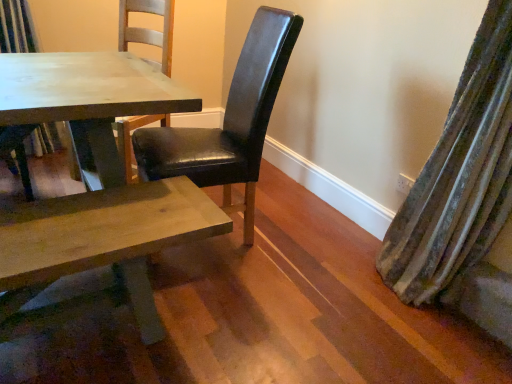
At what (x,y) coordinates should I click in order to perform the action: click on matte wooden table at center. Please return your answer as a coordinate pair (x, y). This screenshot has height=384, width=512. Looking at the image, I should click on (88, 100).

Describe the element at coordinates (88, 100) in the screenshot. I see `matte wooden table at center` at that location.

The image size is (512, 384). Find the location of `matte black chair at center, the second chair viewed from the front`. matte black chair at center, the second chair viewed from the front is located at coordinates 28,149.

The height and width of the screenshot is (384, 512). Find the location of `black leather chair at center, arranged as the second chair when viewed from the left`. black leather chair at center, arranged as the second chair when viewed from the left is located at coordinates (229, 121).

I want to click on matte wooden table at center, so click(x=88, y=100).

In the image, is matte black chair at center, positioned as the 1th chair in back-to-front order, on the left side or the right side of black leather chair at center, which is counted as the 2th chair, starting from the back?

From the image, it's evident that matte black chair at center, positioned as the 1th chair in back-to-front order, is to the left of black leather chair at center, which is counted as the 2th chair, starting from the back.

Can you confirm if matte black chair at center, the second chair viewed from the front, is shorter than black leather chair at center, the 1th chair viewed from the right?

Indeed, matte black chair at center, the second chair viewed from the front, has a lesser height compared to black leather chair at center, the 1th chair viewed from the right.

Considering the points (4, 10) and (237, 88), which point is behind, point (4, 10) or point (237, 88)?

The point (237, 88) is farther from the camera.

Can you tell me how much matte black chair at center, positioned as the 1th chair in back-to-front order, and black leather chair at center, arranged as the second chair when viewed from the left, differ in facing direction?

The angular difference between matte black chair at center, positioned as the 1th chair in back-to-front order, and black leather chair at center, arranged as the second chair when viewed from the left, is 99.7 degrees.

Which of these two, velvet green curtain at right or black leather chair at center, the 1th chair viewed from the right, is smaller?

velvet green curtain at right.

Would you say velvet green curtain at right is inside or outside black leather chair at center, which is counted as the 2th chair, starting from the back?

velvet green curtain at right exists outside the volume of black leather chair at center, which is counted as the 2th chair, starting from the back.

Which is behind, velvet green curtain at right or black leather chair at center, arranged as the second chair when viewed from the left?

black leather chair at center, arranged as the second chair when viewed from the left, is behind.

Is velvet green curtain at right facing away from black leather chair at center, which is counted as the 2th chair, starting from the back?

That's not correct — velvet green curtain at right is not looking away from black leather chair at center, which is counted as the 2th chair, starting from the back.

Which is more to the right, velvet green curtain at right or matte wooden table at center?

From the viewer's perspective, velvet green curtain at right appears more on the right side.

From the image's perspective, who appears lower, velvet green curtain at right or matte wooden table at center?

velvet green curtain at right.

Find the location of a particular element. The image size is (512, 384). kitchen & dining room table below the velvet green curtain at right (from a real-world perspective) is located at coordinates (88, 100).

Does point (402, 269) come farther from viewer compared to point (103, 143)?

Yes, it is.

How many degrees apart are the facing directions of matte wooden table at center and black leather chair at center, the 1th chair viewed from the right?

The facing directions of matte wooden table at center and black leather chair at center, the 1th chair viewed from the right, are 37.1 degrees apart.

From the image's perspective, is matte wooden table at center above or below black leather chair at center, which is the 1th chair from front to back?

Based on their image positions, matte wooden table at center is located above black leather chair at center, which is the 1th chair from front to back.

Considering the relative sizes of matte wooden table at center and black leather chair at center, which is counted as the 2th chair, starting from the back, in the image provided, is matte wooden table at center smaller than black leather chair at center, which is counted as the 2th chair, starting from the back,?

Indeed, matte wooden table at center has a smaller size compared to black leather chair at center, which is counted as the 2th chair, starting from the back.

Is matte wooden table at center wider or thinner than black leather chair at center, arranged as the second chair when viewed from the left?

In the image, matte wooden table at center appears to be more narrow than black leather chair at center, arranged as the second chair when viewed from the left.

Is point (13, 16) less distant than point (492, 41)?

That is False.

Considering the relative sizes of matte black chair at center, placed as the 2th chair when sorted from right to left, and velvet green curtain at right in the image provided, is matte black chair at center, placed as the 2th chair when sorted from right to left, thinner than velvet green curtain at right?

Indeed, matte black chair at center, placed as the 2th chair when sorted from right to left, has a lesser width compared to velvet green curtain at right.

From the image's perspective, which one is positioned higher, matte black chair at center, the second chair viewed from the front, or velvet green curtain at right?

matte black chair at center, the second chair viewed from the front, from the image's perspective.

There is a velvet green curtain at right. What are the coordinates of `the 2nd chair below it (from a real-world perspective)` in the screenshot? It's located at (28, 149).

Would you say black leather chair at center, the 1th chair viewed from the right, is to the left or to the right of velvet green curtain at right in the picture?

Based on their positions, black leather chair at center, the 1th chair viewed from the right, is located to the left of velvet green curtain at right.

Is black leather chair at center, the 1th chair viewed from the right, thinner than velvet green curtain at right?

Incorrect, the width of black leather chair at center, the 1th chair viewed from the right, is not less than that of velvet green curtain at right.

Which is less distant, (245,105) or (417,253)?

Point (245,105) is farther from the camera than point (417,253).

Who is bigger, black leather chair at center, the 1th chair viewed from the right, or velvet green curtain at right?

black leather chair at center, the 1th chair viewed from the right.

Considering the points (231, 170) and (38, 111), which point is behind, point (231, 170) or point (38, 111)?

Point (231, 170)

From a real-world perspective, relative to matte wooden table at center, is black leather chair at center, arranged as the second chair when viewed from the left, vertically above or below?

black leather chair at center, arranged as the second chair when viewed from the left, is situated higher than matte wooden table at center in the real world.

How different are the orientations of black leather chair at center, which is counted as the 2th chair, starting from the back, and matte wooden table at center in degrees?

The angular difference between black leather chair at center, which is counted as the 2th chair, starting from the back, and matte wooden table at center is 37.1 degrees.

Where is `kitchen & dining room table located underneath the black leather chair at center, arranged as the second chair when viewed from the left (from a real-world perspective)`? The height and width of the screenshot is (384, 512). kitchen & dining room table located underneath the black leather chair at center, arranged as the second chair when viewed from the left (from a real-world perspective) is located at coordinates [x=88, y=100].

In order to click on chair on the right side of matte black chair at center, the first chair positioned from the left in this screenshot , I will do `click(229, 121)`.

Identify the location of the 1st chair below the velvet green curtain at right (from a real-world perspective). This screenshot has width=512, height=384. (229, 121).

Considering their positions, is velvet green curtain at right positioned closer to black leather chair at center, arranged as the second chair when viewed from the left, than matte black chair at center, positioned as the 1th chair in back-to-front order?

velvet green curtain at right is positioned closer to the anchor black leather chair at center, arranged as the second chair when viewed from the left.

Considering their positions, is matte wooden table at center positioned further to velvet green curtain at right than black leather chair at center, the 1th chair viewed from the right?

The object further to velvet green curtain at right is matte wooden table at center.

Looking at the image, which one is located closer to matte black chair at center, the first chair positioned from the left, matte wooden table at center or black leather chair at center, the 1th chair viewed from the right?

matte wooden table at center is positioned closer to the anchor matte black chair at center, the first chair positioned from the left.

Considering their positions, is black leather chair at center, arranged as the second chair when viewed from the left, positioned closer to velvet green curtain at right than matte wooden table at center?

black leather chair at center, arranged as the second chair when viewed from the left.

Considering their positions, is matte wooden table at center positioned further to matte black chair at center, placed as the 2th chair when sorted from right to left, than velvet green curtain at right?

velvet green curtain at right is positioned further to the anchor matte black chair at center, placed as the 2th chair when sorted from right to left.

Looking at the image, which one is located further to matte black chair at center, placed as the 2th chair when sorted from right to left, black leather chair at center, which is counted as the 2th chair, starting from the back, or velvet green curtain at right?

velvet green curtain at right.

Looking at the image, which one is located further to velvet green curtain at right, matte black chair at center, placed as the 2th chair when sorted from right to left, or matte wooden table at center?

Based on the image, matte black chair at center, placed as the 2th chair when sorted from right to left, appears to be further to velvet green curtain at right.

Looking at the image, which one is located closer to velvet green curtain at right, matte wooden table at center or matte black chair at center, placed as the 2th chair when sorted from right to left?

matte wooden table at center lies closer to velvet green curtain at right than the other object.

This screenshot has height=384, width=512. Identify the location of kitchen & dining room table between matte black chair at center, the second chair viewed from the front, and black leather chair at center, which is the 1th chair from front to back, from left to right. (88, 100).

Identify the location of chair between matte wooden table at center and velvet green curtain at right in the horizontal direction. (229, 121).

Identify the location of chair between matte black chair at center, placed as the 2th chair when sorted from right to left, and velvet green curtain at right from left to right. (x=229, y=121).

Locate an element on the screen. Image resolution: width=512 pixels, height=384 pixels. kitchen & dining room table between matte black chair at center, positioned as the 1th chair in back-to-front order, and velvet green curtain at right, in the horizontal direction is located at coordinates (88, 100).